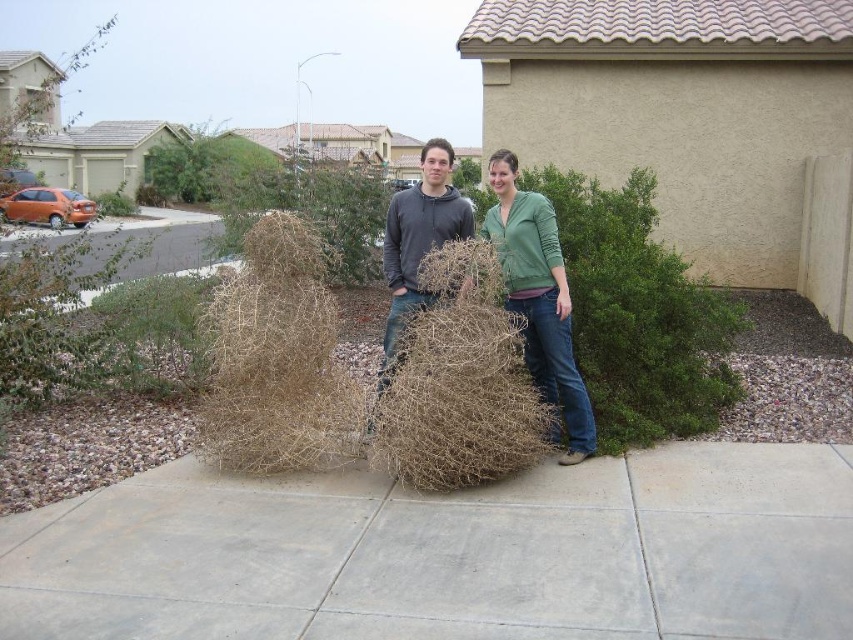
Question: Which object is closer to the camera taking this photo?

Choices:
 (A) brown textured tumbleweed at center
 (B) dry straw at center
 (C) gray concrete pavement at center

Answer: (C)

Question: Which of the following is the closest to the observer?

Choices:
 (A) dark gray hoodie at center
 (B) gray concrete pavement at center
 (C) dry straw at center

Answer: (B)

Question: Where is green matte jacket at center located in relation to dark gray hoodie at center in the image?

Choices:
 (A) right
 (B) left

Answer: (A)

Question: Is green matte jacket at center positioned before dark gray hoodie at center?

Choices:
 (A) yes
 (B) no

Answer: (A)

Question: Among these points, which one is farthest from the camera?

Choices:
 (A) (309, 250)
 (B) (556, 381)

Answer: (B)

Question: Can you confirm if green matte jacket at center is smaller than dark gray hoodie at center?

Choices:
 (A) yes
 (B) no

Answer: (A)